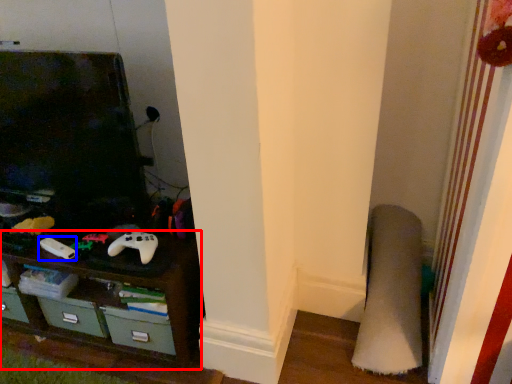
Question: Which object is closer to the camera taking this photo, shelf (highlighted by a red box) or game controller (highlighted by a blue box)?

Choices:
 (A) shelf
 (B) game controller

Answer: (A)